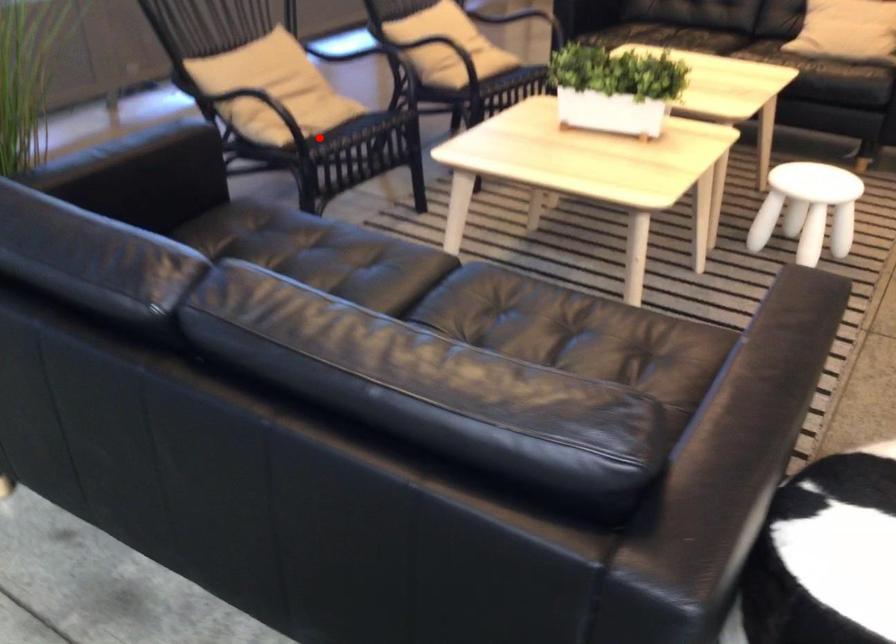
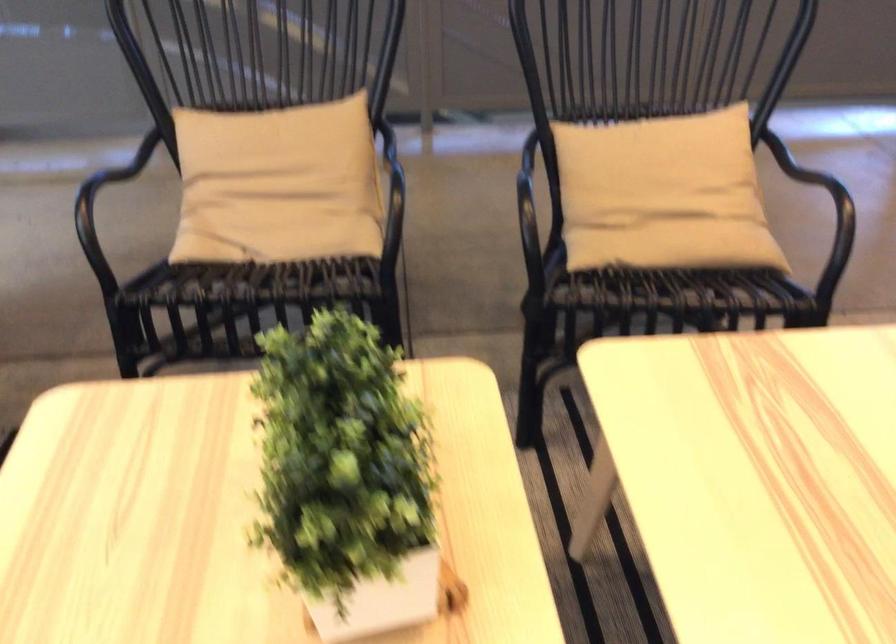
Question: I am providing you with two images of the same scene from different viewpoints. Given a red point in image1, look at the same physical point in image2. Is it:

Choices:
 (A) Closer to the viewpoint
 (B) Farther from the viewpoint

Answer: (A)